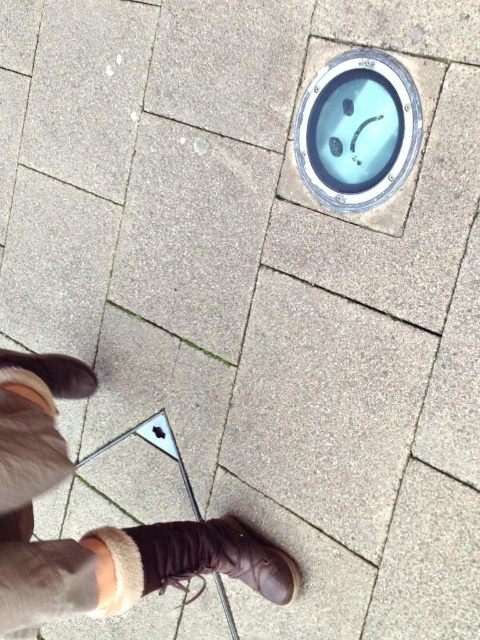
Does blue glossy manhole cover at upper center have a smaller size compared to brown suede boot at lower left?

Yes.

Can you confirm if blue glossy manhole cover at upper center is positioned above brown suede boot at lower left?

Yes.

Where is `blue glossy manhole cover at upper center`? The height and width of the screenshot is (640, 480). blue glossy manhole cover at upper center is located at coordinates (358, 129).

Locate an element on the screen. The image size is (480, 640). blue glossy manhole cover at upper center is located at coordinates (358, 129).

In the scene shown: Is brown suede boots at lower center positioned before brown suede boot at lower left?

Yes, brown suede boots at lower center is closer to the viewer.

Is brown suede boots at lower center smaller than brown suede boot at lower left?

No.

Between point (50, 384) and point (60, 376), which one is positioned behind?

Point (60, 376)

At what (x,y) coordinates should I click in order to perform the action: click on brown suede boots at lower center. Please return your answer as a coordinate pair (x, y). This screenshot has height=640, width=480. Looking at the image, I should click on (98, 528).

Can you confirm if brown suede boots at lower center is positioned to the right of brown suede boot at lower center?

No, brown suede boots at lower center is not to the right of brown suede boot at lower center.

How distant is brown suede boots at lower center from brown suede boot at lower center?

The distance of brown suede boots at lower center from brown suede boot at lower center is 3.64 inches.

Image resolution: width=480 pixels, height=640 pixels. Describe the element at coordinates (98, 528) in the screenshot. I see `brown suede boots at lower center` at that location.

The image size is (480, 640). Find the location of `brown suede boots at lower center`. brown suede boots at lower center is located at coordinates (98, 528).